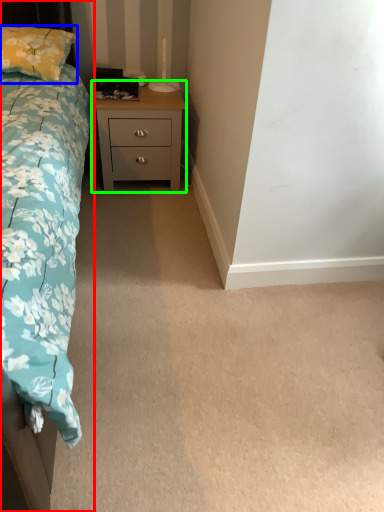
Question: Which object is the farthest from bed (highlighted by a red box)? Choose among these: pillow (highlighted by a blue box) or nightstand (highlighted by a green box).

Choices:
 (A) pillow
 (B) nightstand

Answer: (A)